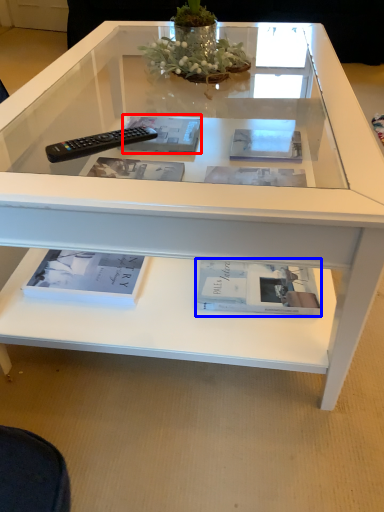
Question: Which of the following is the closest to the observer, magazine (highlighted by a red box) or book (highlighted by a blue box)?

Choices:
 (A) magazine
 (B) book

Answer: (B)